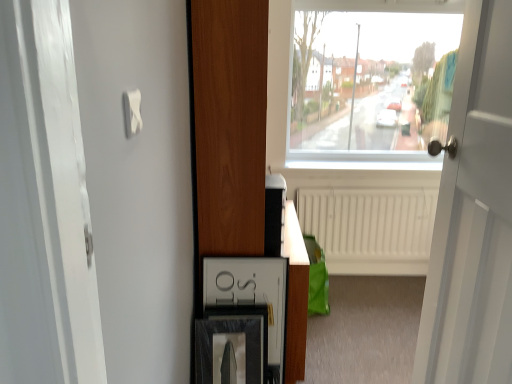
Locate an element on the screen. The width and height of the screenshot is (512, 384). white matte radiator at center is located at coordinates (370, 228).

The image size is (512, 384). Describe the element at coordinates (228, 126) in the screenshot. I see `white glossy dresser at center` at that location.

Describe the element at coordinates (251, 294) in the screenshot. I see `matte black medicine cabinet at lower center` at that location.

Where is `white wooden door at right`? white wooden door at right is located at coordinates (473, 216).

From the image's perspective, would you say matte black picture frame at lower center is shown under white glossy dresser at center?

Yes, from the image's perspective, matte black picture frame at lower center is beneath white glossy dresser at center.

Is matte black picture frame at lower center wider or thinner than white glossy dresser at center?

In the image, matte black picture frame at lower center appears to be more narrow than white glossy dresser at center.

Does matte black picture frame at lower center appear on the left side of white glossy dresser at center?

Indeed, matte black picture frame at lower center is positioned on the left side of white glossy dresser at center.

Is matte black picture frame at lower center facing away from white glossy dresser at center?

No, matte black picture frame at lower center's orientation is not away from white glossy dresser at center.

Is white glossy dresser at center situated inside matte black medicine cabinet at lower center or outside?

white glossy dresser at center is not enclosed by matte black medicine cabinet at lower center.

Image resolution: width=512 pixels, height=384 pixels. What are the coordinates of `dresser that is above the matte black medicine cabinet at lower center (from a real-world perspective)` in the screenshot? It's located at (228, 126).

Between white glossy dresser at center and matte black medicine cabinet at lower center, which one has less height?

With less height is matte black medicine cabinet at lower center.

Does point (199, 137) come closer to viewer compared to point (281, 327)?

Yes, it is in front of point (281, 327).

Would you say matte black picture frame at lower center is to the left or to the right of white wooden door at right in the picture?

From the image, it's evident that matte black picture frame at lower center is to the left of white wooden door at right.

Which of these two, matte black picture frame at lower center or white wooden door at right, is wider?

matte black picture frame at lower center is wider.

Measure the distance from matte black picture frame at lower center to white wooden door at right.

The distance of matte black picture frame at lower center from white wooden door at right is 32.51 inches.

From the picture: Considering the relative sizes of matte black picture frame at lower center and white wooden door at right in the image provided, is matte black picture frame at lower center bigger than white wooden door at right?

Actually, matte black picture frame at lower center might be smaller than white wooden door at right.

Is white wooden door at right oriented towards matte black picture frame at lower center?

No, white wooden door at right is not aimed at matte black picture frame at lower center.

The height and width of the screenshot is (384, 512). In the image, there is a matte black picture frame at lower center. What are the coordinates of `door above it (from the image's perspective)` in the screenshot? It's located at (473, 216).

Would you say white wooden door at right is a long distance from matte black picture frame at lower center?

No, there isn't a large distance between white wooden door at right and matte black picture frame at lower center.

Which is behind, point (439, 211) or point (230, 348)?

The point (230, 348) is farther.

How much distance is there between white wooden door at right and white glossy dresser at center?

28.96 inches.

From a real-world perspective, which is physically below, white wooden door at right or white glossy dresser at center?

white glossy dresser at center is physically lower.

Between white wooden door at right and white glossy dresser at center, which one appears on the left side from the viewer's perspective?

Positioned to the left is white glossy dresser at center.

From the image's perspective, is white wooden door at right under white glossy dresser at center?

Yes.

Considering the relative positions of matte black picture frame at lower center and white matte radiator at center in the image provided, is matte black picture frame at lower center behind white matte radiator at center?

That is False.

Considering the positions of point (265, 346) and point (393, 274), is point (265, 346) closer or farther from the camera than point (393, 274)?

Point (265, 346).

Would you consider matte black picture frame at lower center to be distant from white matte radiator at center?

matte black picture frame at lower center is positioned a significant distance from white matte radiator at center.

Can you confirm if white matte radiator at center is bigger than white glossy dresser at center?

Incorrect, white matte radiator at center is not larger than white glossy dresser at center.

Considering the sizes of white matte radiator at center and white glossy dresser at center in the image, is white matte radiator at center wider or thinner than white glossy dresser at center?

Considering their sizes, white matte radiator at center looks slimmer than white glossy dresser at center.

What's the angular difference between white matte radiator at center and white glossy dresser at center's facing directions?

white matte radiator at center and white glossy dresser at center are facing 90.9 degrees away from each other.

Which object is positioned more to the left, white matte radiator at center or white glossy dresser at center?

white glossy dresser at center.

Image resolution: width=512 pixels, height=384 pixels. Identify the location of dresser in front of the matte black picture frame at lower center. pos(228,126).

You are a GUI agent. You are given a task and a screenshot of the screen. Output one action in this format:
    pyautogui.click(x=<x>, y=<y>)
    Task: Click on the dresser to the right of matte black medicine cabinet at lower center
    
    Given the screenshot: What is the action you would take?
    pyautogui.click(x=228, y=126)

Based on their spatial positions, is white matte radiator at center or white wooden door at right closer to white glossy dresser at center?

white wooden door at right is closer to white glossy dresser at center.

When comparing their distances from white glossy dresser at center, does matte black picture frame at lower center or matte black medicine cabinet at lower center seem further?

Based on the image, matte black picture frame at lower center appears to be further to white glossy dresser at center.

Which object lies nearer to the anchor point white matte radiator at center, white wooden door at right or white glossy dresser at center?

The object closer to white matte radiator at center is white glossy dresser at center.

Estimate the real-world distances between objects in this image. Which object is closer to white glossy dresser at center, matte black picture frame at lower center or white matte radiator at center?

The object closer to white glossy dresser at center is matte black picture frame at lower center.

Considering their positions, is matte black picture frame at lower center positioned closer to matte black medicine cabinet at lower center than white wooden door at right?

Based on the image, matte black picture frame at lower center appears to be nearer to matte black medicine cabinet at lower center.

Estimate the real-world distances between objects in this image. Which object is closer to white glossy dresser at center, white wooden door at right or matte black picture frame at lower center?

matte black picture frame at lower center is closer to white glossy dresser at center.

Consider the image. Which object lies nearer to the anchor point white wooden door at right, matte black medicine cabinet at lower center or white matte radiator at center?

The object closer to white wooden door at right is matte black medicine cabinet at lower center.

Based on the photo, from the image, which object appears to be farther from white matte radiator at center, white glossy dresser at center or white wooden door at right?

white wooden door at right is positioned further to the anchor white matte radiator at center.

Identify the location of dresser located between white wooden door at right and matte black medicine cabinet at lower center in the depth direction. This screenshot has height=384, width=512. (228, 126).

Locate an element on the screen. This screenshot has width=512, height=384. medicine cabinet between white wooden door at right and white matte radiator at center along the z-axis is located at coordinates (251, 294).

The height and width of the screenshot is (384, 512). In order to click on picture frame between white wooden door at right and matte black medicine cabinet at lower center along the z-axis in this screenshot , I will do `click(230, 350)`.

Find the location of `medicine cabinet positioned between white glossy dresser at center and white matte radiator at center from near to far`. medicine cabinet positioned between white glossy dresser at center and white matte radiator at center from near to far is located at coordinates (251, 294).